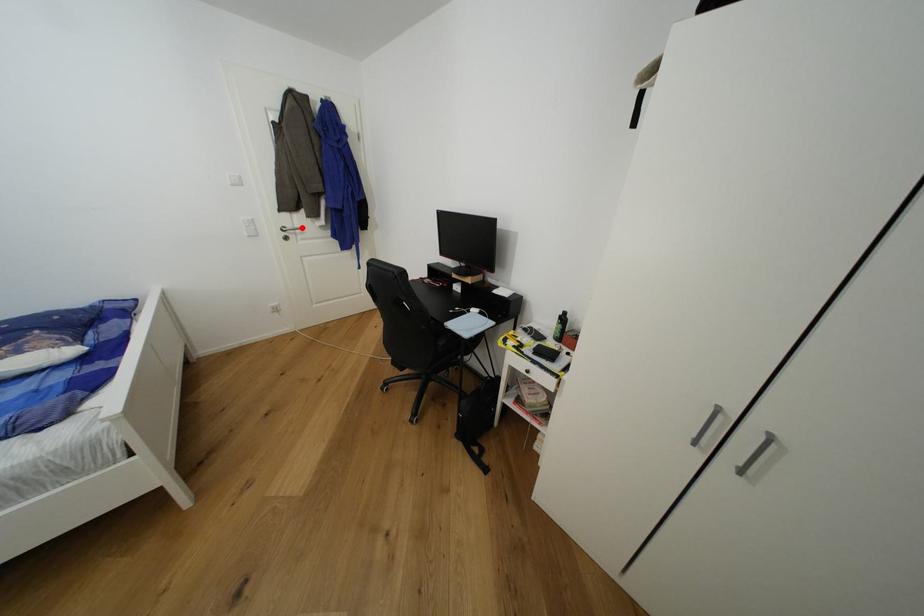
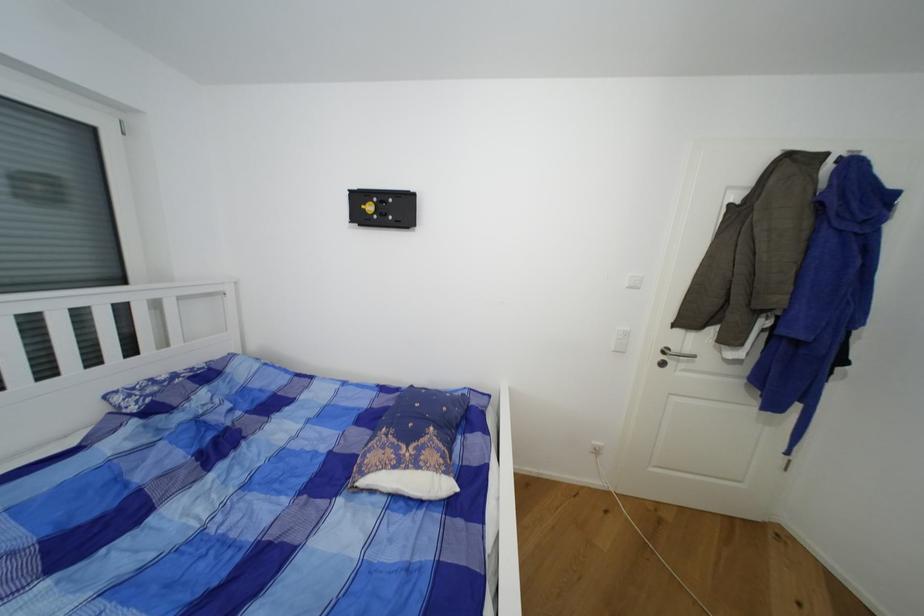
Where in the second image is the point corresponding to the highlighted location from the first image?

(691, 352)